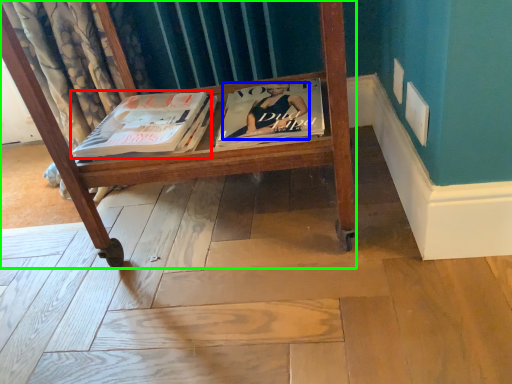
Question: Which object is the farthest from book (highlighted by a red box)? Choose among these: person (highlighted by a blue box) or furniture (highlighted by a green box).

Choices:
 (A) person
 (B) furniture

Answer: (A)